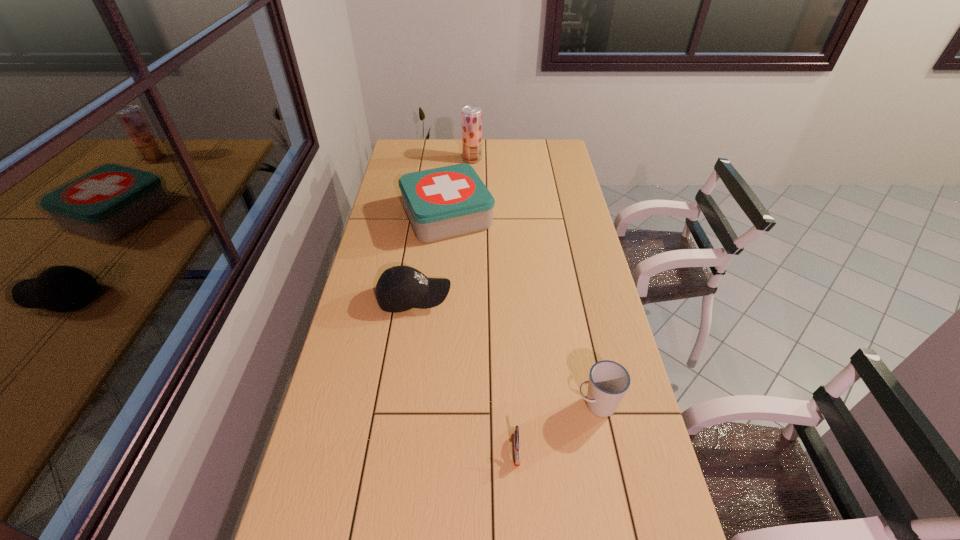
In the image, there is a desktop. Where is `vacant space at the left edge`? This screenshot has height=540, width=960. vacant space at the left edge is located at coordinates (364, 441).

At what (x,y) coordinates should I click in order to perform the action: click on free space at the right edge. Please return your answer as a coordinate pair (x, y). This screenshot has height=540, width=960. Looking at the image, I should click on (570, 314).

The width and height of the screenshot is (960, 540). In order to click on free space at the far left corner of the desktop in this screenshot , I will do `click(392, 162)`.

In the image, there is a desktop. Where is `free space at the far right corner`? The height and width of the screenshot is (540, 960). free space at the far right corner is located at coordinates pyautogui.click(x=544, y=153).

This screenshot has height=540, width=960. What are the coordinates of `empty space that is in between the baseball cap and the stapler` in the screenshot? It's located at (466, 374).

Image resolution: width=960 pixels, height=540 pixels. Identify the location of free space between the first-aid kit and the rightmost object. (522, 310).

Find the location of `free space between the nearest object and the third farthest object`. free space between the nearest object and the third farthest object is located at coordinates (466, 374).

Identify the location of vacant area that lies between the first-aid kit and the baseball cap. (431, 257).

Image resolution: width=960 pixels, height=540 pixels. In order to click on vacant area between the stapler and the baseball cap in this screenshot , I will do `click(466, 374)`.

Locate an element on the screen. This screenshot has width=960, height=540. free point between the rightmost object and the baseball cap is located at coordinates (506, 351).